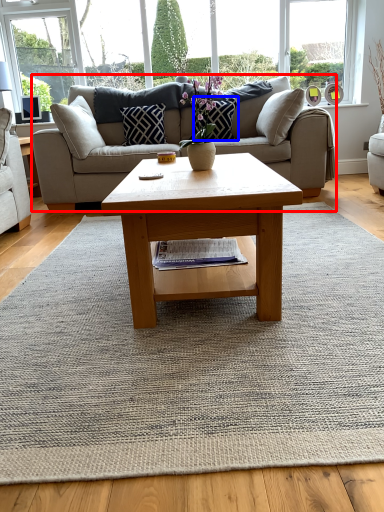
Question: Among these objects, which one is nearest to the camera, studio couch (highlighted by a red box) or pillow (highlighted by a blue box)?

Choices:
 (A) studio couch
 (B) pillow

Answer: (A)